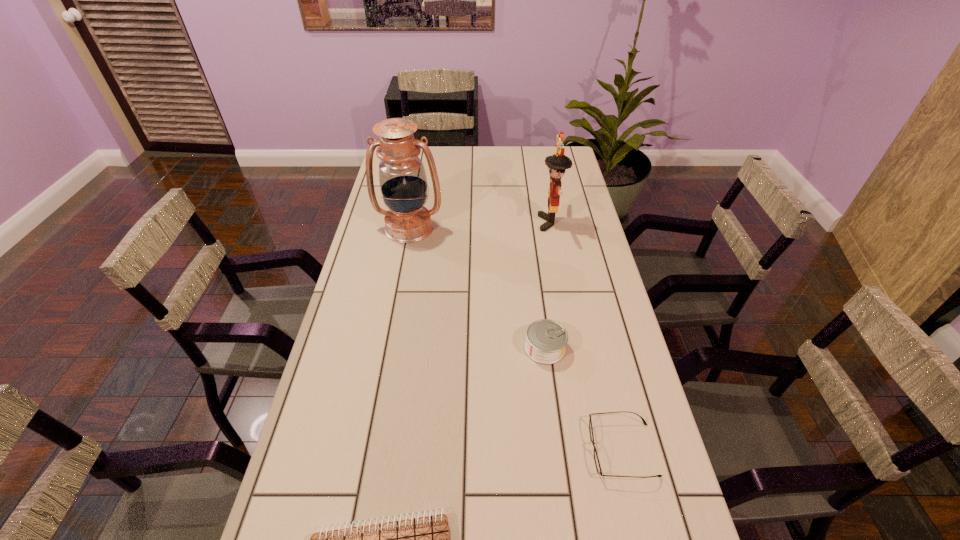
In the image, there is a desktop. Where is `free region at the far right corner`? The image size is (960, 540). free region at the far right corner is located at coordinates (567, 147).

I want to click on free space between the oil lamp and the can, so [477, 288].

This screenshot has height=540, width=960. Identify the location of free spot between the spectacles and the oil lamp. (516, 339).

This screenshot has width=960, height=540. Find the location of `free spot between the oil lamp and the nutcracker`. free spot between the oil lamp and the nutcracker is located at coordinates [480, 225].

The height and width of the screenshot is (540, 960). What are the coordinates of `free spot between the third farthest object and the nutcracker` in the screenshot? It's located at (548, 285).

At what (x,y) coordinates should I click in order to perform the action: click on free spot between the nutcracker and the oil lamp. Please return your answer as a coordinate pair (x, y). This screenshot has height=540, width=960. Looking at the image, I should click on (480, 225).

Where is `empty space between the third tallest object and the nutcracker`? empty space between the third tallest object and the nutcracker is located at coordinates (548, 285).

At what (x,y) coordinates should I click in order to perform the action: click on free space that is in between the nutcracker and the can. Please return your answer as a coordinate pair (x, y). Looking at the image, I should click on (548, 285).

The width and height of the screenshot is (960, 540). Find the location of `object that stands as the fourth closest to the nutcracker`. object that stands as the fourth closest to the nutcracker is located at coordinates (428, 539).

In order to click on the second closest object to the oil lamp in this screenshot , I will do `click(546, 339)`.